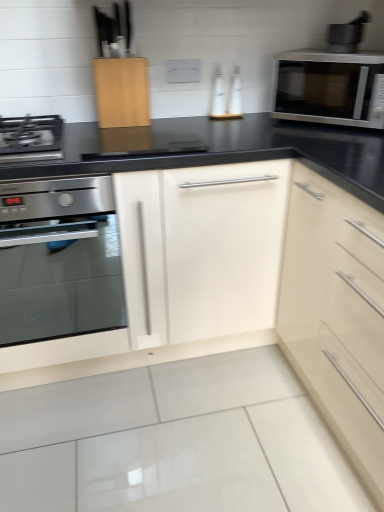
Locate an element on the screen. blank area to the left of metallic gray mortar and pestle at upper right is located at coordinates (320, 51).